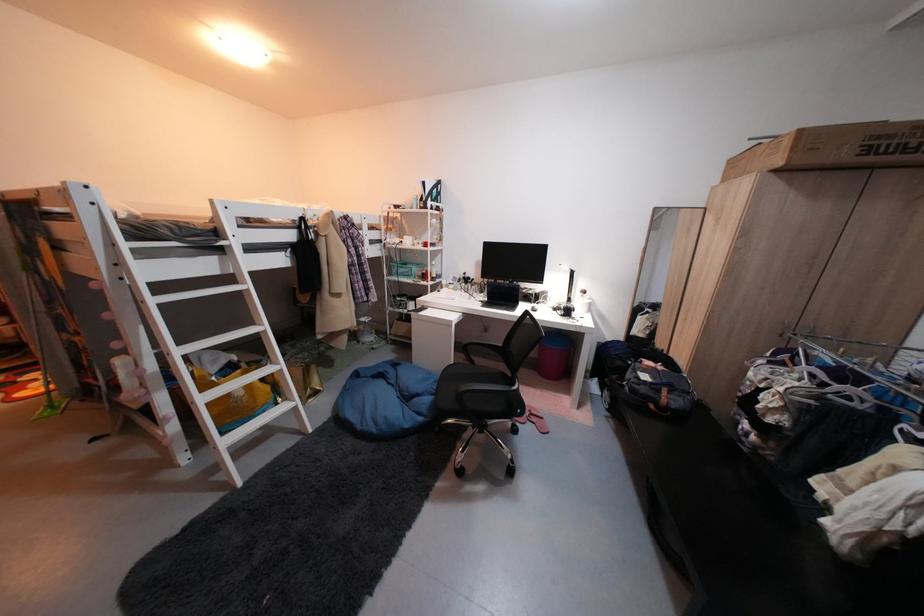
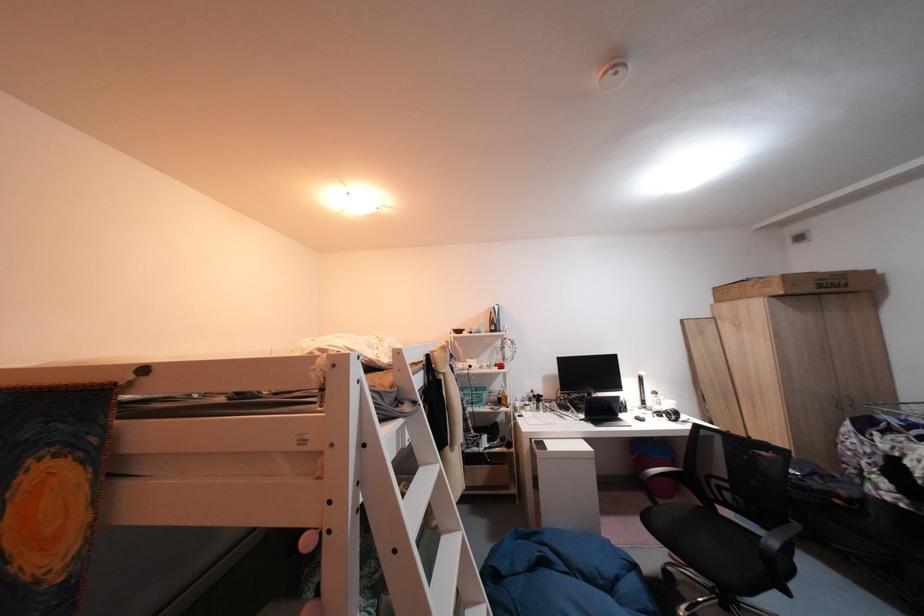
In the second image, find the point that corresponds to (x=812, y=132) in the first image.

(794, 278)